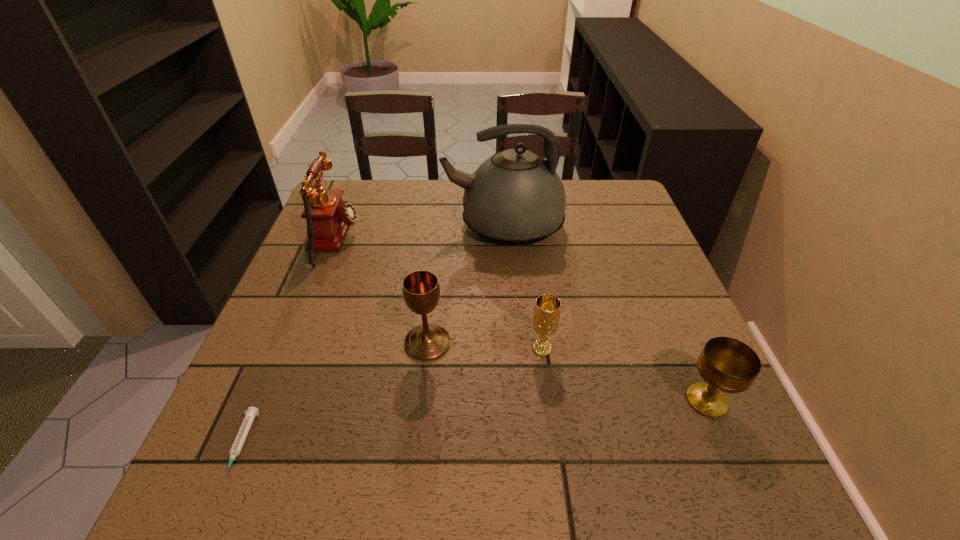
This screenshot has width=960, height=540. Find the location of `kettle`. kettle is located at coordinates (515, 198).

At what (x,y) coordinates should I click in order to perform the action: click on telephone. Please return your answer as a coordinate pair (x, y). The width and height of the screenshot is (960, 540). Looking at the image, I should click on (328, 217).

Image resolution: width=960 pixels, height=540 pixels. In order to click on the leftmost chalice in this screenshot , I will do `click(421, 291)`.

The width and height of the screenshot is (960, 540). I want to click on the tallest chalice, so click(421, 291).

You are a GUI agent. You are given a task and a screenshot of the screen. Output one action in this format:
    pyautogui.click(x=<x>, y=<y>)
    Task: Click on the second chalice from left to right
    The height and width of the screenshot is (540, 960).
    Given the screenshot: What is the action you would take?
    pyautogui.click(x=546, y=316)

Locate an element on the screen. The height and width of the screenshot is (540, 960). the rightmost chalice is located at coordinates (728, 365).

Where is `the rightmost object`? This screenshot has width=960, height=540. the rightmost object is located at coordinates (728, 365).

Where is `syringe`? Image resolution: width=960 pixels, height=540 pixels. syringe is located at coordinates (236, 448).

You are a GUI agent. You are given a task and a screenshot of the screen. Output one action in this format:
    pyautogui.click(x=<x>, y=<y>)
    Task: Click on the vacant point located at the spout of the kettle
    The image size is (960, 540).
    Given the screenshot: What is the action you would take?
    pyautogui.click(x=367, y=226)

The width and height of the screenshot is (960, 540). I want to click on blank space located at the spout of the kettle, so click(x=331, y=226).